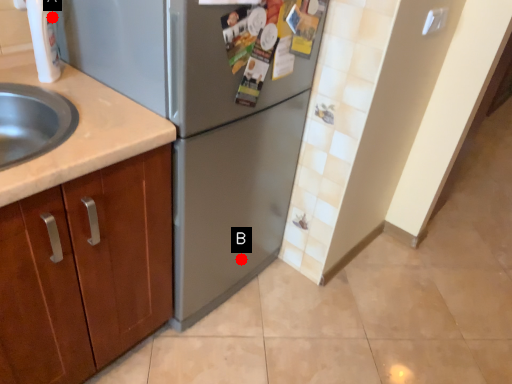
Question: Two points are circled on the image, labeled by A and B beside each circle. Among these points, which one is nearest to the camera?

Choices:
 (A) A is closer
 (B) B is closer

Answer: (A)